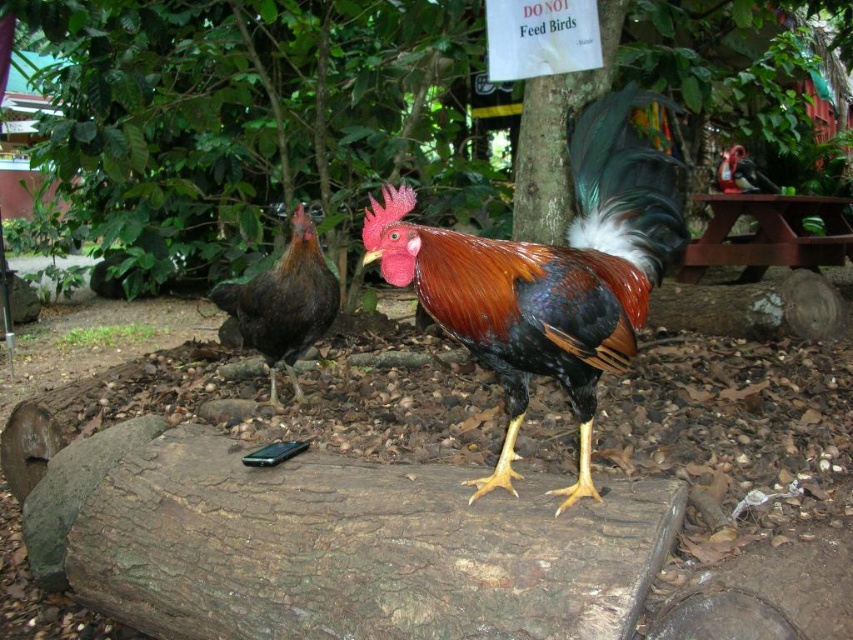
Is green leafy tree at center above dark brown feathers at left?

Correct, green leafy tree at center is located above dark brown feathers at left.

This screenshot has width=853, height=640. What do you see at coordinates (248, 115) in the screenshot? I see `green leafy tree at center` at bounding box center [248, 115].

Locate an element on the screen. green leafy tree at center is located at coordinates (248, 115).

Can you confirm if shiny multicolored rooster at center is smaller than dark brown feathers at left?

Incorrect, shiny multicolored rooster at center is not smaller in size than dark brown feathers at left.

Who is higher up, shiny multicolored rooster at center or dark brown feathers at left?

shiny multicolored rooster at center is above.

Which is behind, point (595, 376) or point (331, 280)?

Positioned behind is point (331, 280).

You are a GUI agent. You are given a task and a screenshot of the screen. Output one action in this format:
    pyautogui.click(x=<x>, y=<y>)
    Task: Click on the shiny multicolored rooster at center
    
    Given the screenshot: What is the action you would take?
    pyautogui.click(x=548, y=276)

Looking at this image, which is below, green leafy tree at center or shiny multicolored rooster at center?

Positioned lower is shiny multicolored rooster at center.

The height and width of the screenshot is (640, 853). Describe the element at coordinates (248, 115) in the screenshot. I see `green leafy tree at center` at that location.

Does point (119, 189) come closer to viewer compared to point (647, 148)?

No, it is not.

You are a GUI agent. You are given a task and a screenshot of the screen. Output one action in this format:
    pyautogui.click(x=<x>, y=<y>)
    Task: Click on the green leafy tree at center
    This screenshot has width=853, height=640.
    Given the screenshot: What is the action you would take?
    248,115